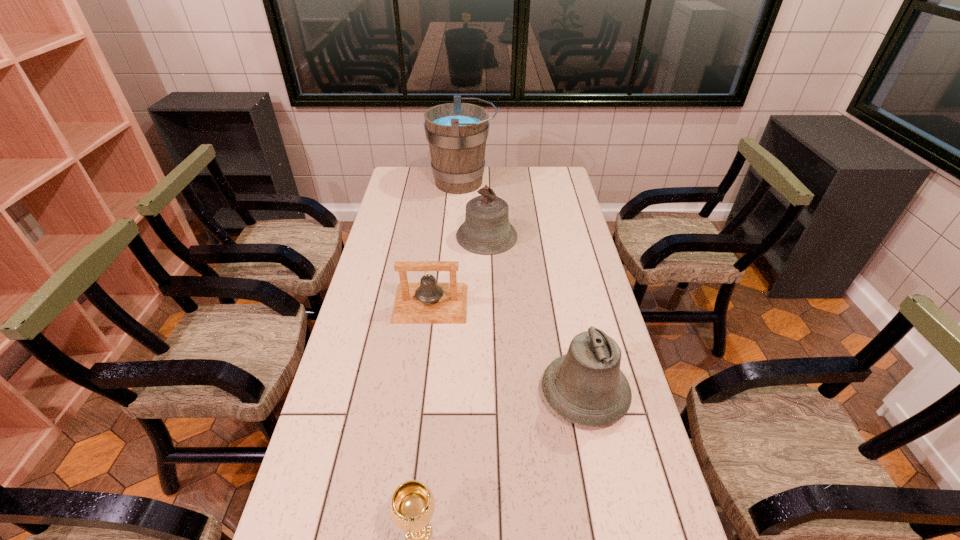
Identify the location of the tallest object. The image size is (960, 540). (457, 132).

At what (x,y) coordinates should I click in order to perform the action: click on the farthest object. Please return your answer as a coordinate pair (x, y). The height and width of the screenshot is (540, 960). Looking at the image, I should click on (457, 132).

Image resolution: width=960 pixels, height=540 pixels. What are the coordinates of `the fourth nearest object` in the screenshot? It's located at pyautogui.click(x=486, y=230).

The height and width of the screenshot is (540, 960). In order to click on the nearest bell in this screenshot , I will do click(585, 386).

I want to click on the rightmost object, so click(585, 386).

At what (x,y) coordinates should I click in order to perform the action: click on the shortest bell. Please return your answer as a coordinate pair (x, y). Image resolution: width=960 pixels, height=540 pixels. Looking at the image, I should click on (427, 302).

You are a GUI agent. You are given a task and a screenshot of the screen. Output one action in this format:
    pyautogui.click(x=<x>, y=<y>)
    Task: Click on the second farthest bell
    
    Given the screenshot: What is the action you would take?
    point(427,302)

I want to click on free space located with a handle on the side of the wine bucket, so click(x=538, y=183).

Find the location of a particular element. This screenshot has height=540, width=960. vacant space located 0.380m on the back of the second farthest object is located at coordinates (486, 175).

Identify the location of free region located on the back of the fourth farthest object. The image size is (960, 540). (574, 346).